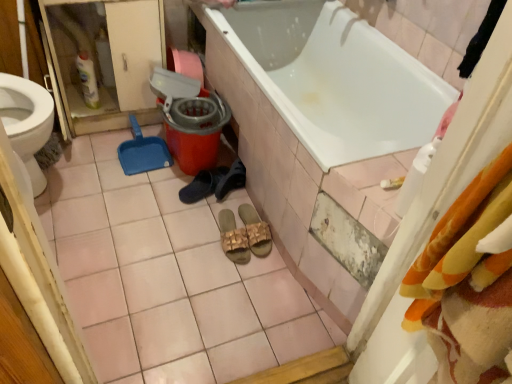
Question: Is matte white screen door at left taller or shorter than black rubber slipper at center, acting as the 3th footwear starting from the right?

Choices:
 (A) short
 (B) tall

Answer: (B)

Question: Considering the positions of matte white screen door at left and black rubber slipper at center, which appears as the first footwear when viewed from the left, in the image, is matte white screen door at left wider or thinner than black rubber slipper at center, which appears as the first footwear when viewed from the left,?

Choices:
 (A) thin
 (B) wide

Answer: (B)

Question: Based on their relative distances, which object is nearer to the orange plastic mop bucket at center?

Choices:
 (A) beige woven sandals at center, the 1th footwear in the right-to-left sequence
 (B) matte white screen door at left
 (C) white glossy bathtub at center
 (D) black suede shoes at center, which ranks as the second footwear in left-to-right order
 (E) black rubber slipper at center, acting as the 3th footwear starting from the right

Answer: (E)

Question: Which object is positioned farthest from the black rubber slipper at center, acting as the 3th footwear starting from the right?

Choices:
 (A) black suede shoes at center, which ranks as the second footwear in left-to-right order
 (B) white glossy bathtub at center
 (C) orange plastic mop bucket at center
 (D) beige woven sandals at center, the 1th footwear in the right-to-left sequence
 (E) matte white screen door at left

Answer: (B)